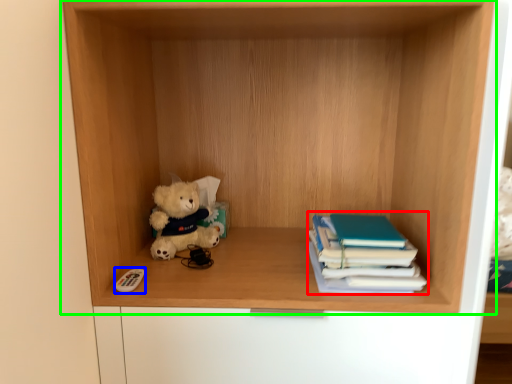
Question: Estimate the real-world distances between objects in this image. Which object is closer to book (highlighted by a red box), toy (highlighted by a blue box) or shelf (highlighted by a green box)?

Choices:
 (A) toy
 (B) shelf

Answer: (B)